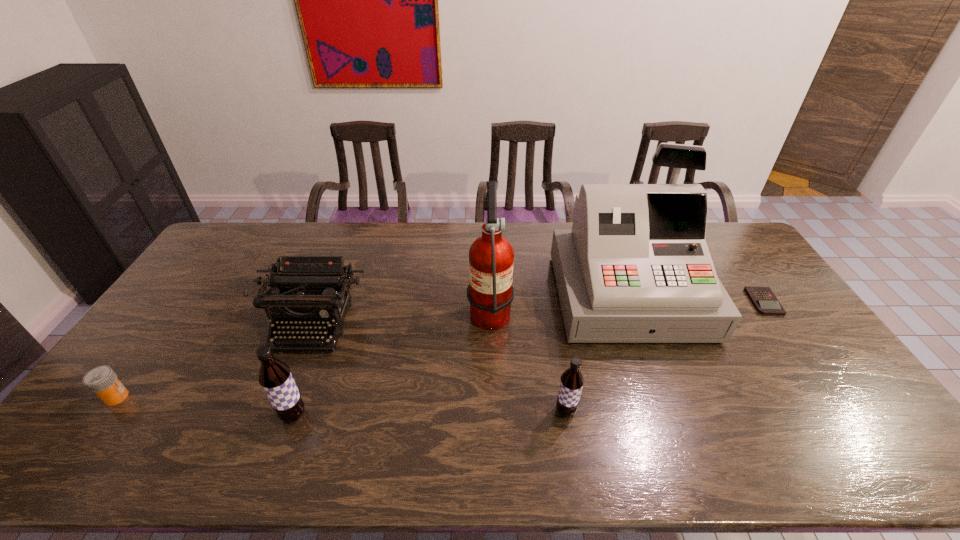
The root beers are evenly distributed in the image. To maintain this, where would you place another root beer on the right? Please point to a free space. Please provide its 2D coordinates. Your answer should be formatted as a tuple, i.e. [(x, y)], where the tuple contains the x and y coordinates of a point satisfying the conditions above.

[(833, 407)]